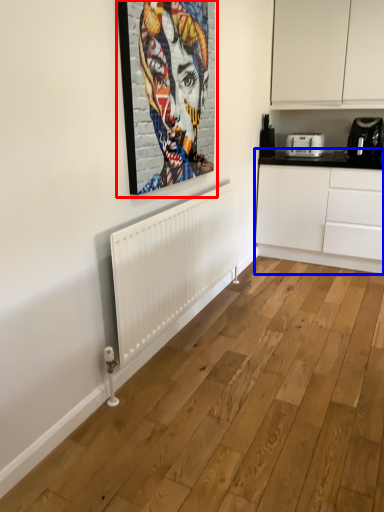
Question: Which point is closer to the camera, picture frame (highlighted by a red box) or cabinetry (highlighted by a blue box)?

Choices:
 (A) picture frame
 (B) cabinetry

Answer: (A)